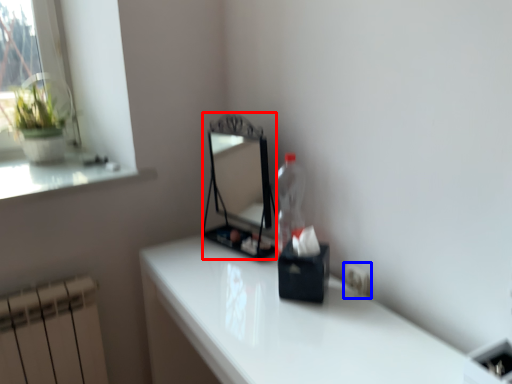
Question: Among these objects, which one is farthest to the camera, mirror (highlighted by a red box) or electric outlet (highlighted by a blue box)?

Choices:
 (A) mirror
 (B) electric outlet

Answer: (A)